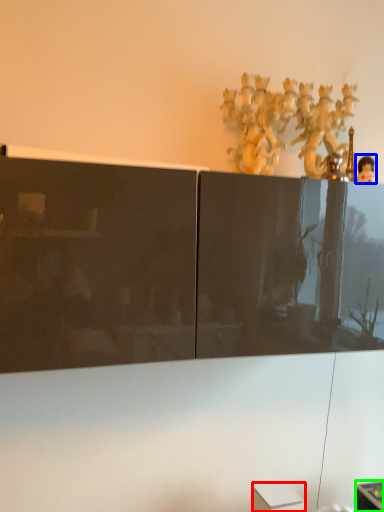
Question: Which is farther away from cabinetry (highlighted by a red box)? toy (highlighted by a blue box) or furniture (highlighted by a green box)?

Choices:
 (A) toy
 (B) furniture

Answer: (A)